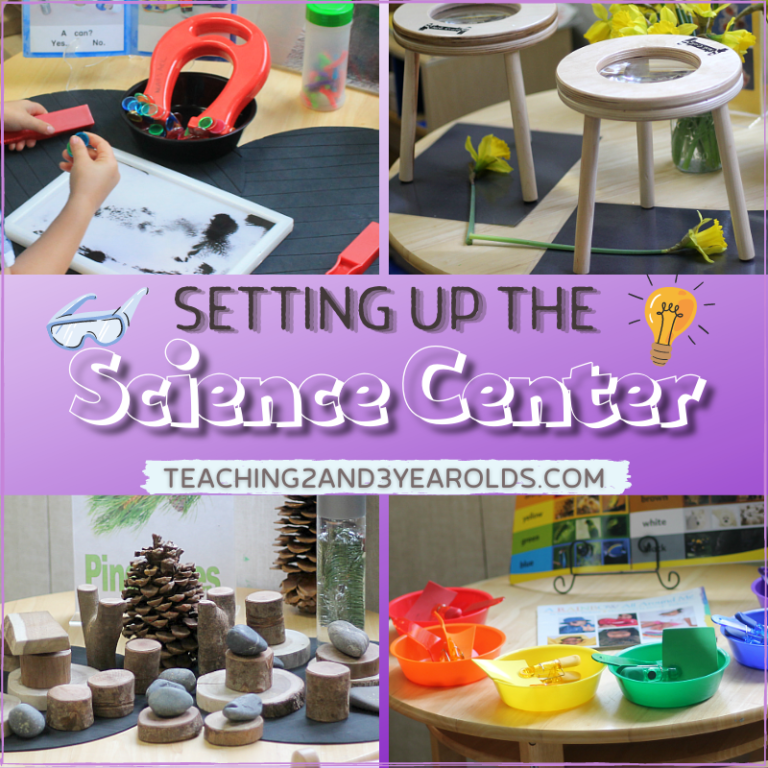
Locate an element on the screen. The width and height of the screenshot is (768, 768). bulb is located at coordinates (667, 305).